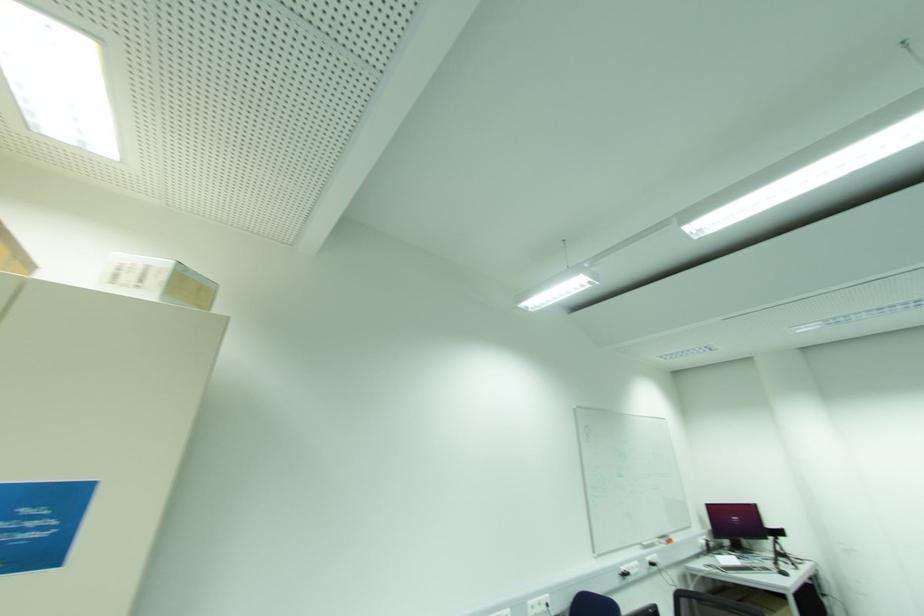
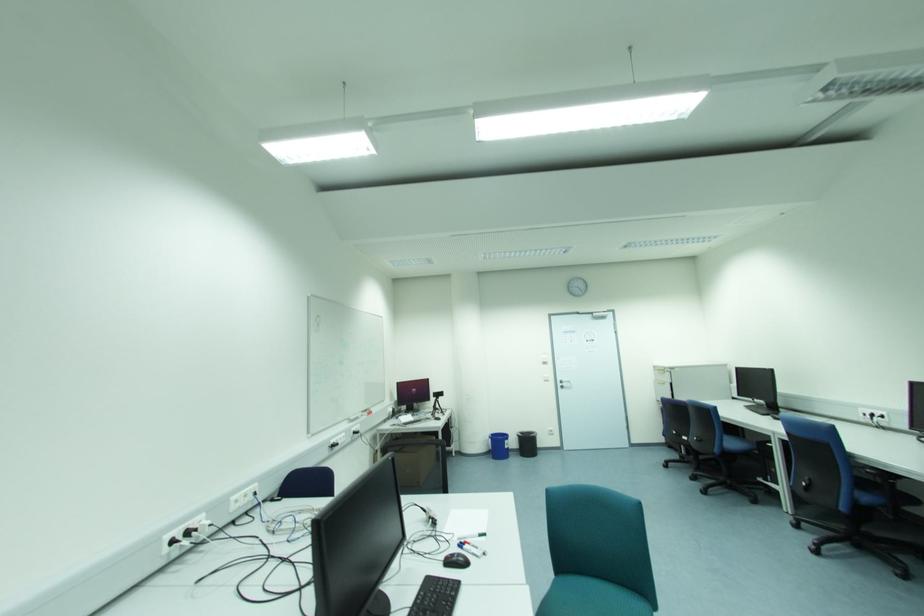
Question: Based on the continuous images, in which direction is the camera rotating? Reply with the corresponding letter.

Choices:
 (A) Left
 (B) Right
 (C) Up
 (D) Down

Answer: (B)